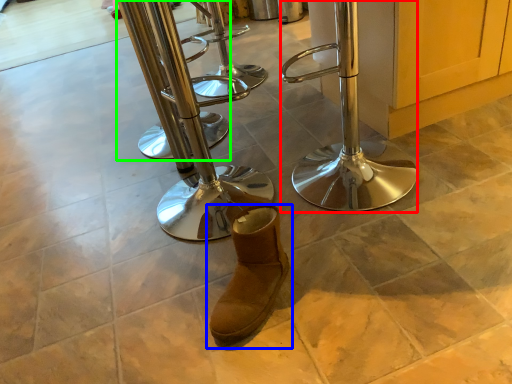
Question: Considering the real-world distances, which object is farthest from step stool (highlighted by a red box)? footwear (highlighted by a blue box) or step stool (highlighted by a green box)?

Choices:
 (A) footwear
 (B) step stool

Answer: (B)